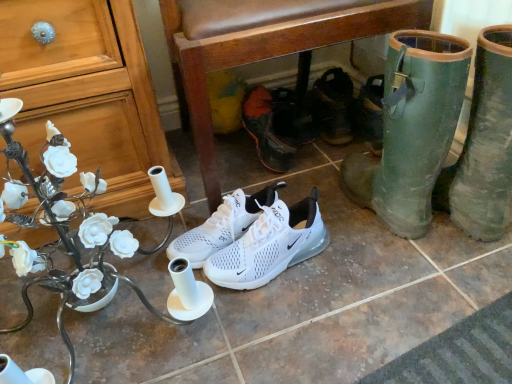
The image size is (512, 384). I want to click on free space in front of white mesh sneakers at center, marked as the third footwear in a back-to-front arrangement, so click(239, 323).